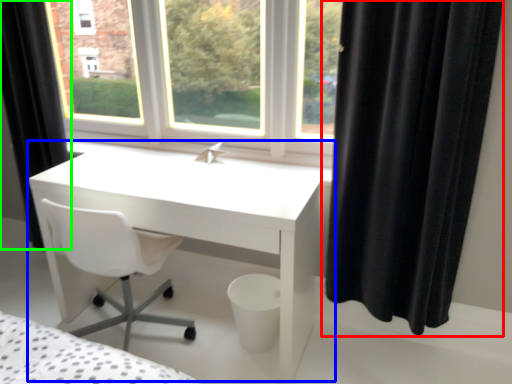
Question: Which is farther away from curtain (highlighted by a red box)? table (highlighted by a blue box) or curtain (highlighted by a green box)?

Choices:
 (A) table
 (B) curtain

Answer: (B)